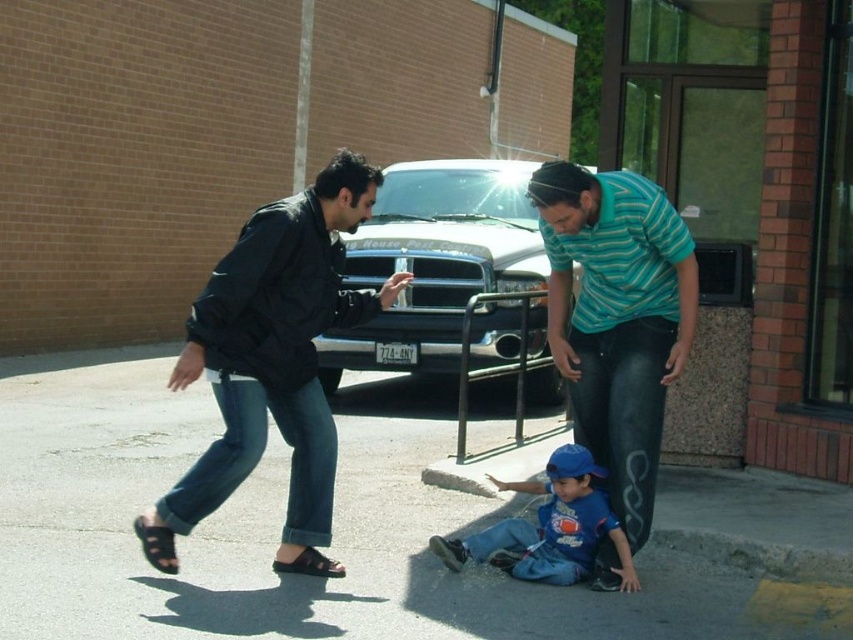
You are standing at the edge of the scene and want to place a small toy on the ground between the concrete curb at lower center and the blue cotton shirt at lower center. Which object should you place the toy closer to so that it remains visible above the shorter object?

The concrete curb at lower center is not as tall as the blue cotton shirt at lower center. Therefore, placing the toy closer to the concrete curb at lower center ensures it stays visible above the shorter object.

You are a photographer standing in the scene and want to take a picture of both the black fabric sandal at lower left and the black rubber sandal at lower left. Which sandal should you focus on first if you want to capture both in the frame without moving the camera?

The black fabric sandal at lower left is positioned on the left side of black rubber sandal at lower left, so you should focus on the black fabric sandal at lower left first to ensure both are in the frame.